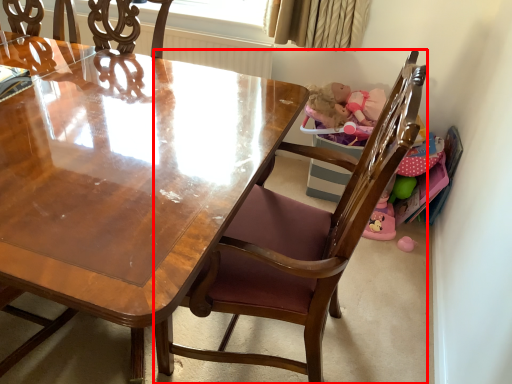
Question: From the image's perspective, considering the relative positions of chair (annotated by the red box) and window screen in the image provided, where is chair (annotated by the red box) located with respect to the staircase?

Choices:
 (A) above
 (B) below

Answer: (B)